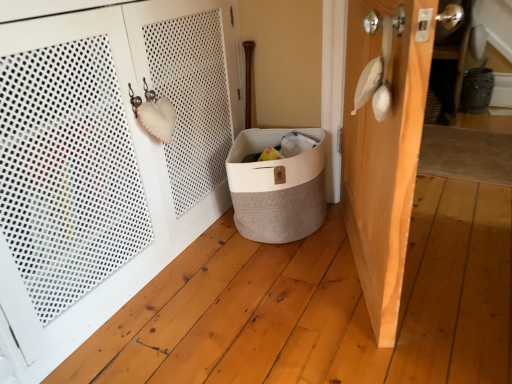
Question: Can we say white woven basket at lower right, which ranks as the 2th door in right-to-left order, lies outside beige woven laundry basket at center?

Choices:
 (A) yes
 (B) no

Answer: (A)

Question: Is white woven basket at lower right, placed as the 1th door when sorted from left to right, taller than beige woven laundry basket at center?

Choices:
 (A) yes
 (B) no

Answer: (A)

Question: Is white woven basket at lower right, which ranks as the 2th door in right-to-left order, wider than beige woven laundry basket at center?

Choices:
 (A) yes
 (B) no

Answer: (B)

Question: Would you consider white woven basket at lower right, placed as the 1th door when sorted from left to right, to be distant from beige woven laundry basket at center?

Choices:
 (A) no
 (B) yes

Answer: (A)

Question: Can you confirm if white woven basket at lower right, placed as the 1th door when sorted from left to right, is bigger than beige woven laundry basket at center?

Choices:
 (A) no
 (B) yes

Answer: (B)

Question: From a real-world perspective, does white woven basket at lower right, which ranks as the 2th door in right-to-left order, sit lower than beige woven laundry basket at center?

Choices:
 (A) yes
 (B) no

Answer: (B)

Question: Is beige woven laundry basket at center not inside white woven basket at lower right, which ranks as the 2th door in right-to-left order?

Choices:
 (A) yes
 (B) no

Answer: (A)

Question: Are beige woven laundry basket at center and white woven basket at lower right, placed as the 1th door when sorted from left to right, located far from each other?

Choices:
 (A) yes
 (B) no

Answer: (B)

Question: From the image's perspective, would you say beige woven laundry basket at center is shown under white woven basket at lower right, placed as the 1th door when sorted from left to right?

Choices:
 (A) yes
 (B) no

Answer: (A)

Question: Does beige woven laundry basket at center have a lesser height compared to white woven basket at lower right, placed as the 1th door when sorted from left to right?

Choices:
 (A) yes
 (B) no

Answer: (A)

Question: Is beige woven laundry basket at center surrounding white woven basket at lower right, placed as the 1th door when sorted from left to right?

Choices:
 (A) no
 (B) yes

Answer: (A)

Question: Considering the relative positions of beige woven laundry basket at center and white woven basket at lower right, which ranks as the 2th door in right-to-left order, in the image provided, is beige woven laundry basket at center to the right of white woven basket at lower right, which ranks as the 2th door in right-to-left order, from the viewer's perspective?

Choices:
 (A) no
 (B) yes

Answer: (B)

Question: Considering the relative sizes of wooden door at right, acting as the first door starting from the right, and white woven basket at lower right, which ranks as the 2th door in right-to-left order, in the image provided, is wooden door at right, acting as the first door starting from the right, taller than white woven basket at lower right, which ranks as the 2th door in right-to-left order,?

Choices:
 (A) yes
 (B) no

Answer: (B)